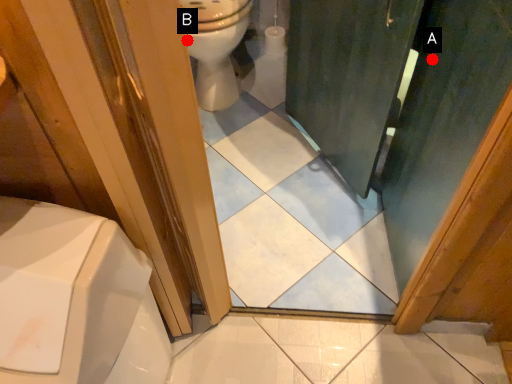
Question: Two points are circled on the image, labeled by A and B beside each circle. Which of the following is the closest to the observer?

Choices:
 (A) A is closer
 (B) B is closer

Answer: (A)